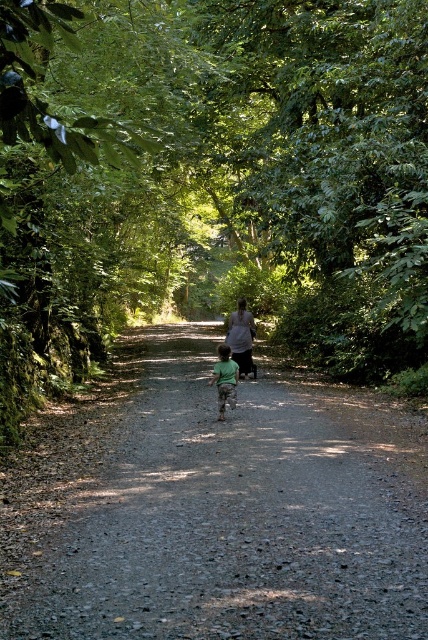
The height and width of the screenshot is (640, 428). What do you see at coordinates (214, 509) in the screenshot? I see `gravelly dirt path at center` at bounding box center [214, 509].

Which is above, gravelly dirt path at center or green matte shirt at center?

green matte shirt at center is higher up.

Does point (94, 561) come in front of point (229, 384)?

Yes, it is in front of point (229, 384).

Locate an element on the screen. The width and height of the screenshot is (428, 640). gravelly dirt path at center is located at coordinates (214, 509).

Which is in front, point (113, 28) or point (380, 589)?

Positioned in front is point (380, 589).

Is green leafy tree at center to the left of gravelly dirt path at center from the viewer's perspective?

No, green leafy tree at center is not to the left of gravelly dirt path at center.

Identify the location of green leafy tree at center. (214, 177).

Which of these two, green leafy tree at center or matte gray shirt at center, stands shorter?

matte gray shirt at center

Does green leafy tree at center have a lesser width compared to matte gray shirt at center?

No, green leafy tree at center is not thinner than matte gray shirt at center.

Where is `green leafy tree at center`? green leafy tree at center is located at coordinates (214, 177).

Identify the location of green leafy tree at center. 214,177.